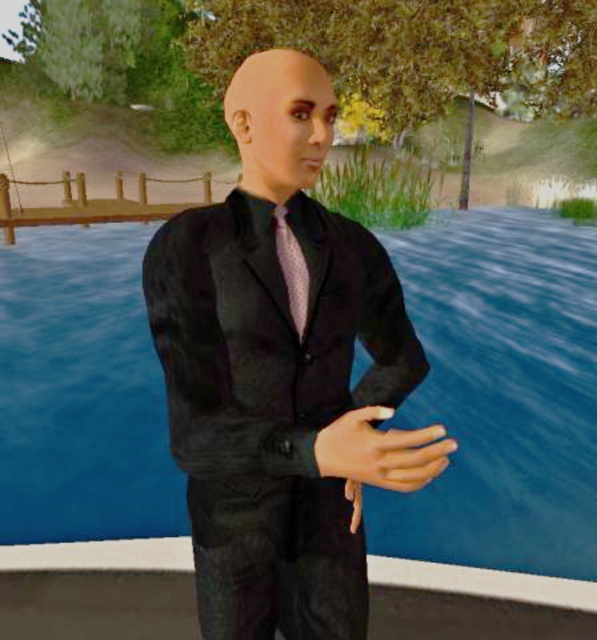
Does black satin suit at center lie in front of pink dotted fabric tie at center?

That is True.

Is point (346, 602) less distant than point (300, 301)?

No, it is not.

Where is `black satin suit at center`? black satin suit at center is located at coordinates (281, 374).